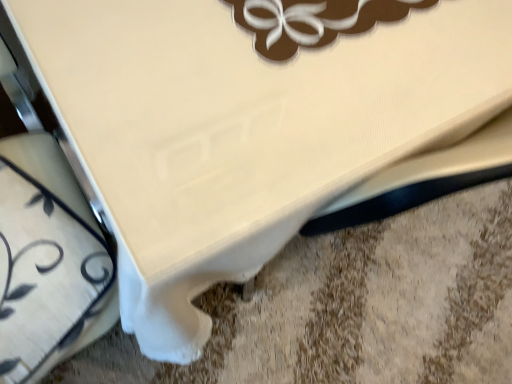
Locate an element on the screen. white fabric bed at lower center is located at coordinates (354, 308).

What do you see at coordinates (354, 308) in the screenshot? I see `white fabric bed at lower center` at bounding box center [354, 308].

Measure the distance between white fabric bed at lower center and camera.

white fabric bed at lower center is 38.09 inches from camera.

Locate an element on the screen. This screenshot has width=512, height=384. white fabric bed at lower center is located at coordinates (354, 308).